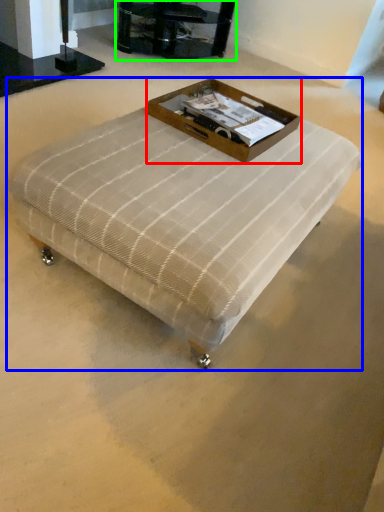
Question: Which is farther away from box (highlighted by a red box)? table (highlighted by a blue box) or furniture (highlighted by a green box)?

Choices:
 (A) table
 (B) furniture

Answer: (B)